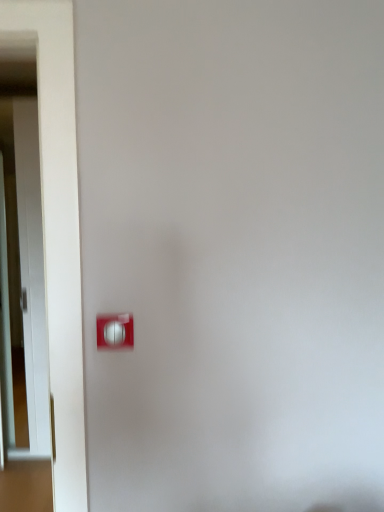
Question: Can you confirm if white plastic light switch at lower left is shorter than white glossy door at left?

Choices:
 (A) yes
 (B) no

Answer: (A)

Question: Is white plastic light switch at lower left outside of white glossy door at left?

Choices:
 (A) yes
 (B) no

Answer: (A)

Question: Considering the relative positions of white plastic light switch at lower left and white glossy door at left in the image provided, is white plastic light switch at lower left behind white glossy door at left?

Choices:
 (A) yes
 (B) no

Answer: (B)

Question: Would you say white plastic light switch at lower left is a long distance from white glossy door at left?

Choices:
 (A) yes
 (B) no

Answer: (A)

Question: From a real-world perspective, is white plastic light switch at lower left physically below white glossy door at left?

Choices:
 (A) yes
 (B) no

Answer: (B)

Question: Is white plastic light switch at lower left wider than white glossy door at left?

Choices:
 (A) no
 (B) yes

Answer: (A)

Question: Is white glossy door at left to the right of white plastic light switch at lower left from the viewer's perspective?

Choices:
 (A) no
 (B) yes

Answer: (A)

Question: Is white glossy door at left further to camera compared to white plastic light switch at lower left?

Choices:
 (A) yes
 (B) no

Answer: (A)

Question: From a real-world perspective, is white glossy door at left over white plastic light switch at lower left?

Choices:
 (A) no
 (B) yes

Answer: (A)

Question: Is white glossy door at left oriented away from white plastic light switch at lower left?

Choices:
 (A) no
 (B) yes

Answer: (A)

Question: Is white glossy door at left placed right next to white plastic light switch at lower left?

Choices:
 (A) no
 (B) yes

Answer: (A)

Question: Can you confirm if white glossy door at left is smaller than white plastic light switch at lower left?

Choices:
 (A) no
 (B) yes

Answer: (A)

Question: Is white glossy door at left taller or shorter than white plastic light switch at lower left?

Choices:
 (A) short
 (B) tall

Answer: (B)